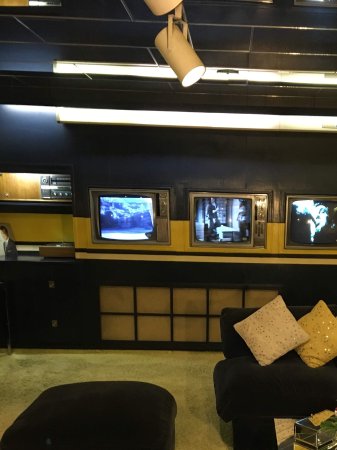
Identify the location of coffee table. This screenshot has height=450, width=337. (261, 435).